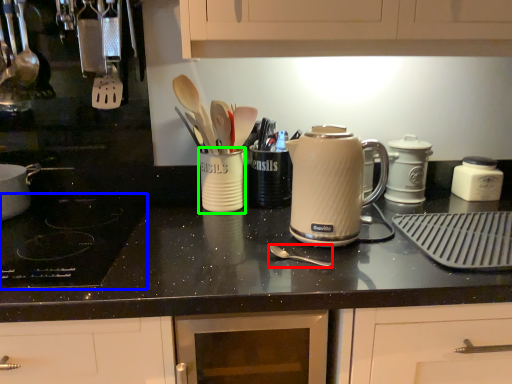
Question: Which is farther away from utensil (highlighted by a red box)? gas stove (highlighted by a blue box) or mug (highlighted by a green box)?

Choices:
 (A) gas stove
 (B) mug

Answer: (A)